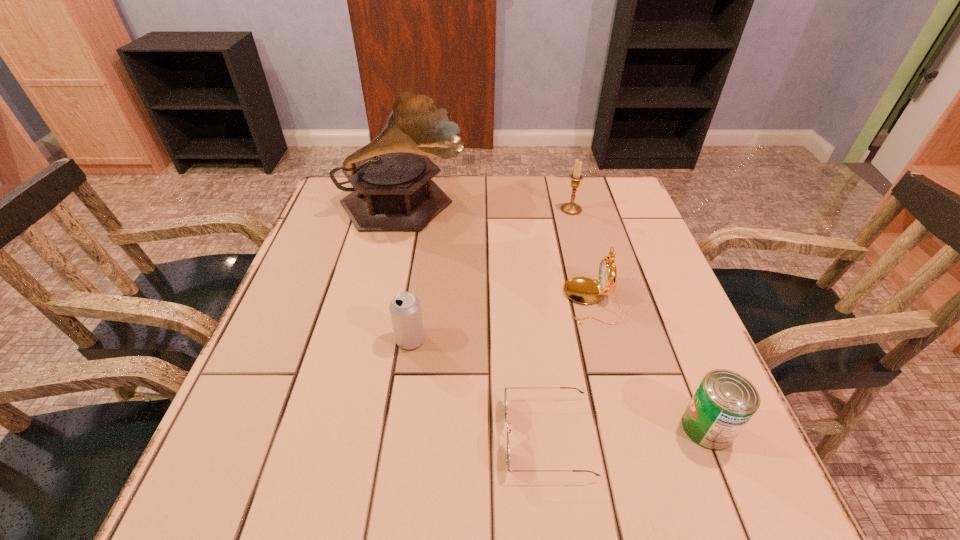
Where is `the tallest object`? the tallest object is located at coordinates (393, 190).

This screenshot has height=540, width=960. I want to click on the second tallest object, so click(x=571, y=208).

In order to click on the third farthest object in this screenshot , I will do `click(583, 290)`.

This screenshot has height=540, width=960. What are the coordinates of `the fourth farthest object` in the screenshot? It's located at pyautogui.click(x=405, y=309).

I want to click on the rightmost object, so click(725, 401).

Where is `sunglasses`? sunglasses is located at coordinates (505, 394).

Where is `the fourth object from right to left`? the fourth object from right to left is located at coordinates (505, 394).

Locate an element on the screen. The image size is (960, 540). vacant space located on the horn direction of the tallest object is located at coordinates (562, 207).

The image size is (960, 540). What are the coordinates of `blank space located 0.350m on the front of the second tallest object` in the screenshot? It's located at (597, 309).

I want to click on free space located 0.180m on the face of the pocket watch, so click(484, 301).